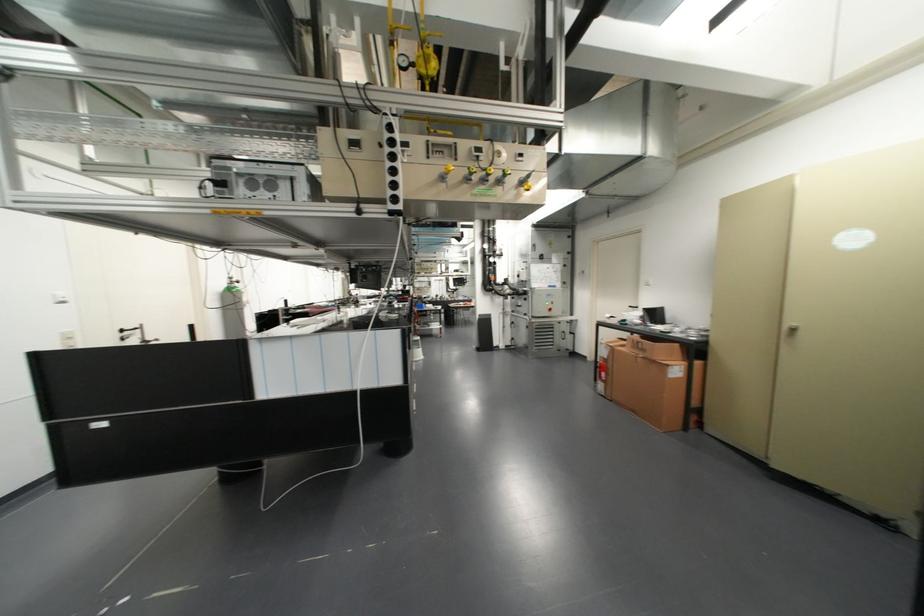
Where is `green control button`? This screenshot has width=924, height=616. green control button is located at coordinates (483, 191).